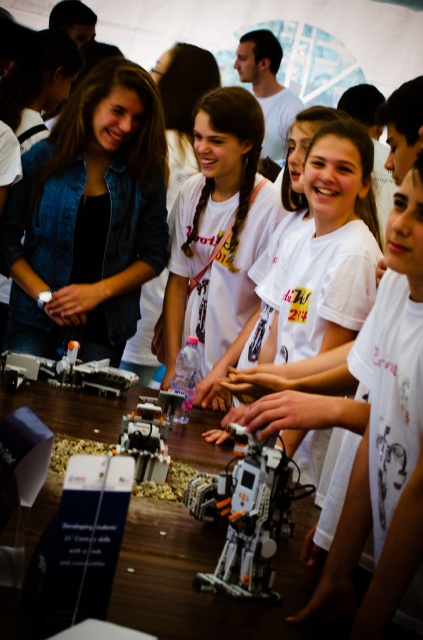
Does denim jacket at upper left have a lesser width compared to white matte hand at center?

Incorrect, denim jacket at upper left's width is not less than white matte hand at center's.

Does point (85, 141) come in front of point (203, 435)?

No, it is not.

I want to click on denim jacket at upper left, so click(x=88, y=212).

Is wooden table at center to the left of smooth white hand at center from the viewer's perspective?

Correct, you'll find wooden table at center to the left of smooth white hand at center.

Find the location of `wooden table at center`. wooden table at center is located at coordinates (206, 572).

Does matte white hand at center have a smaller size compared to smooth skin hand at center?

No.

Is point (255, 387) more distant than point (217, 365)?

No, it is not.

Where is `matte white hand at center`? Image resolution: width=423 pixels, height=640 pixels. matte white hand at center is located at coordinates [x=255, y=381].